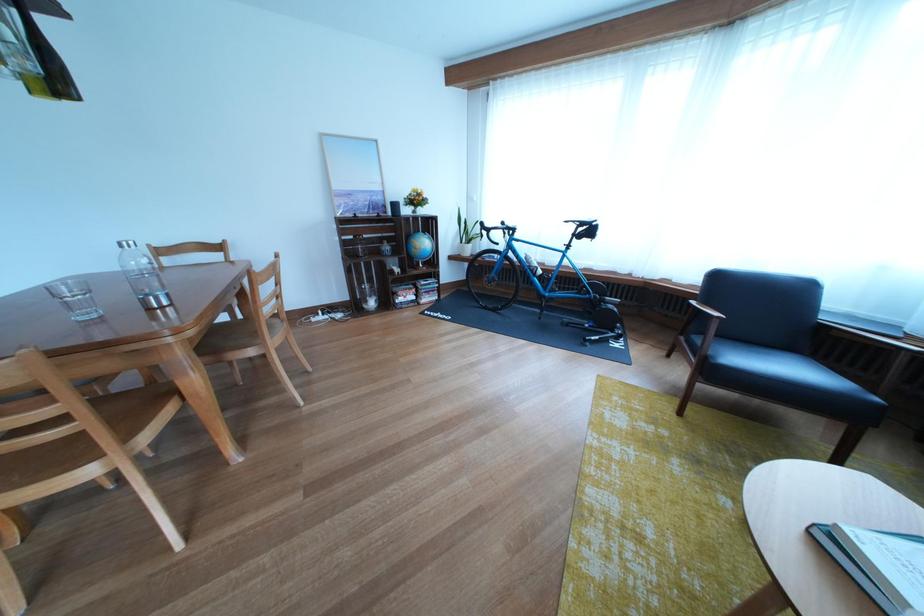
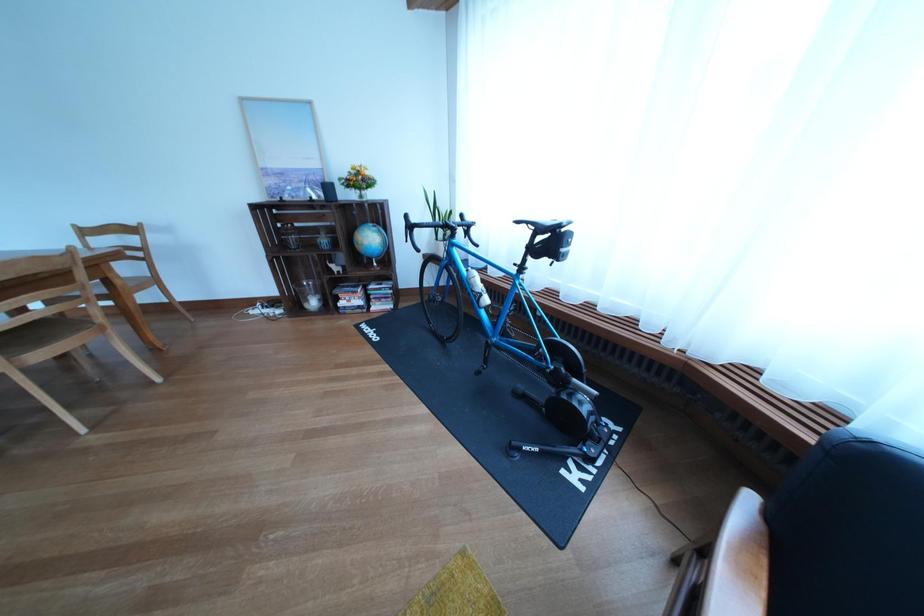
In the second image, find the point that corresponds to point 553,323 in the first image.

(492, 379)